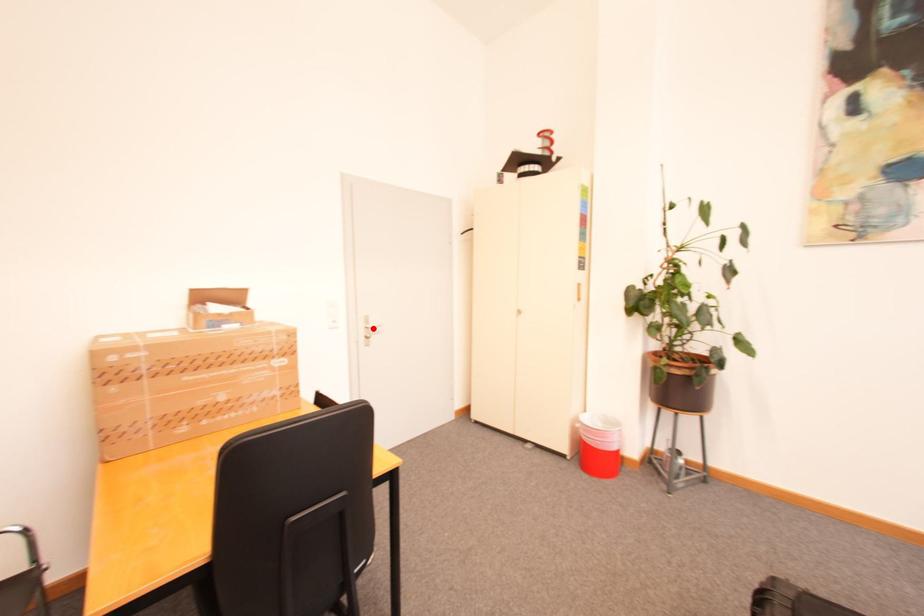
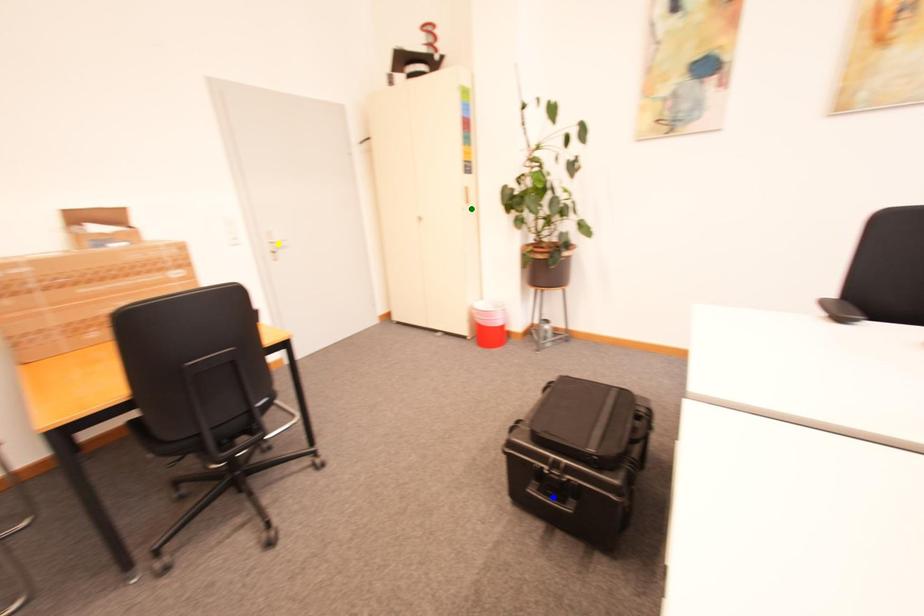
Question: I am providing you with two images of the same scene from different viewpoints. A red point is marked on the first image. You are given multiple points on the second image. Which spot in image 2 lines up with the point in image 1?

Choices:
 (A) blue point
 (B) yellow point
 (C) green point

Answer: (B)